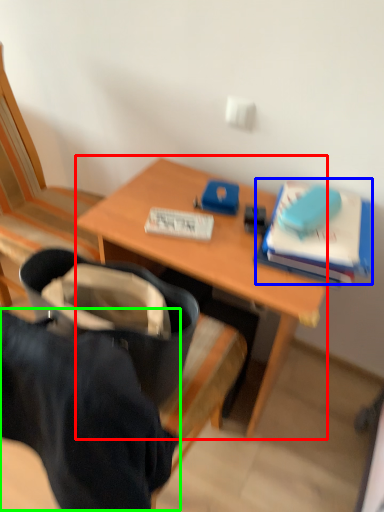
Question: Which object is positioned closest to desk (highlighted by a red box)? Select from paperback book (highlighted by a blue box) and clothing (highlighted by a green box).

Choices:
 (A) paperback book
 (B) clothing

Answer: (A)